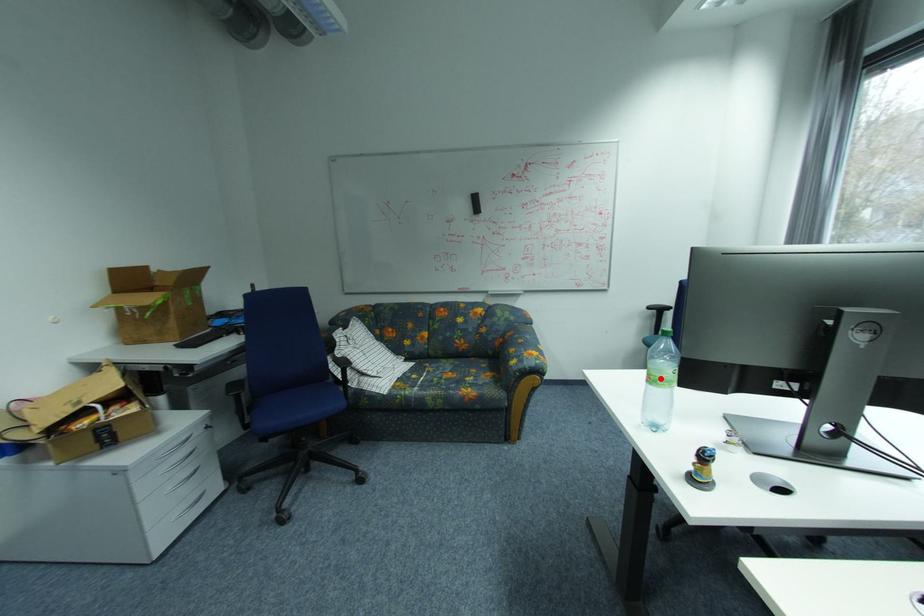
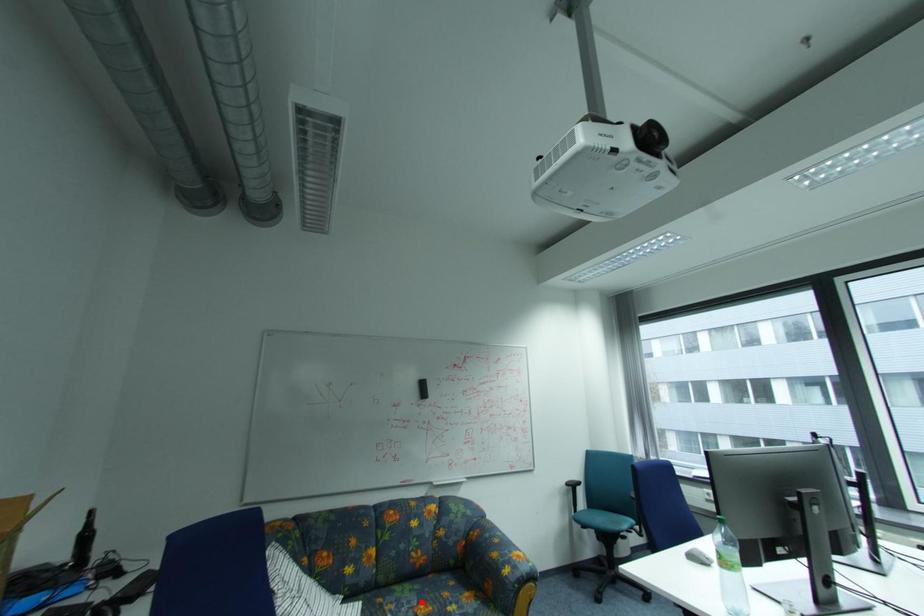
I am providing you with two images of the same scene from different viewpoints. A red point is marked on the first image and another point is marked on the second image. Do the highlighted points in image1 and image2 indicate the same real-world spot?

No